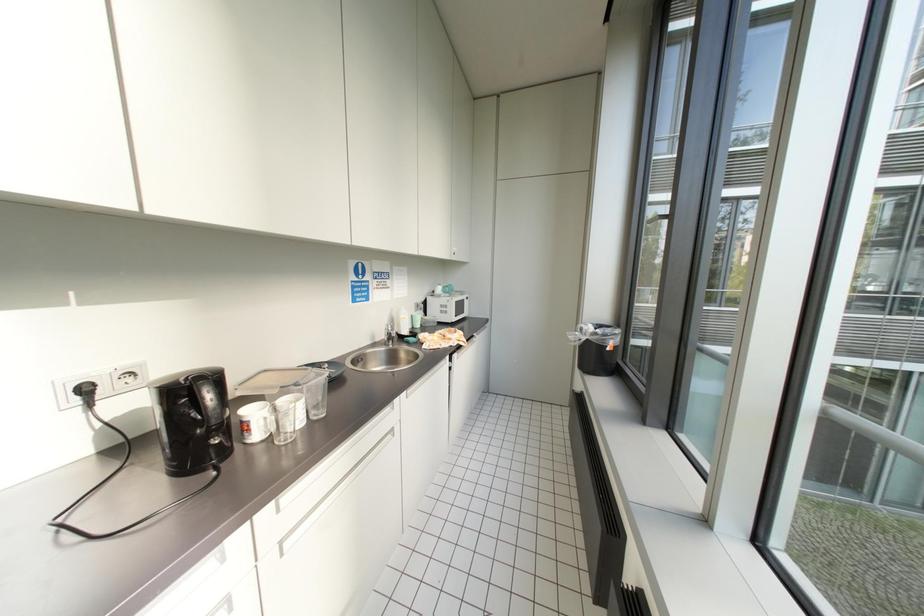
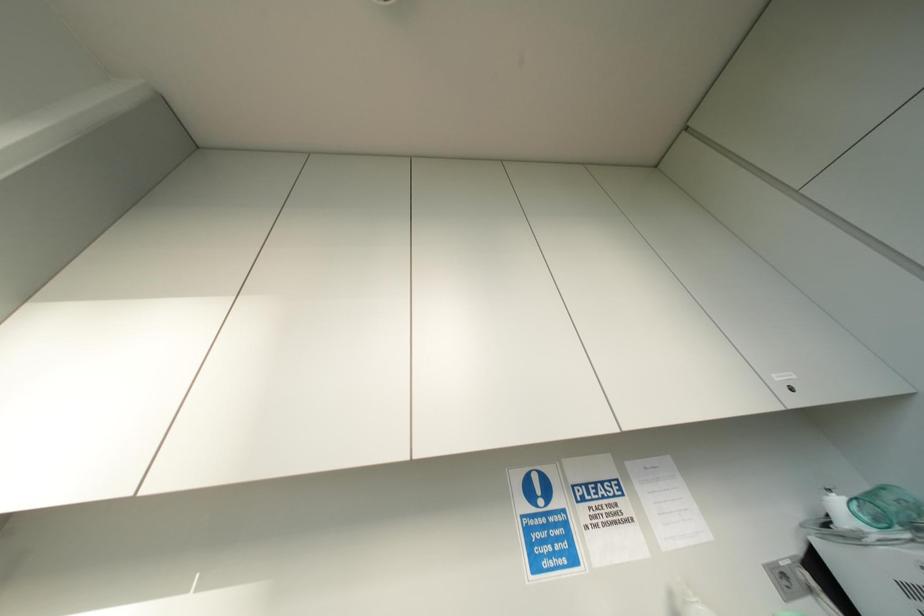
How did the camera likely rotate?

The camera rotated toward left-up.